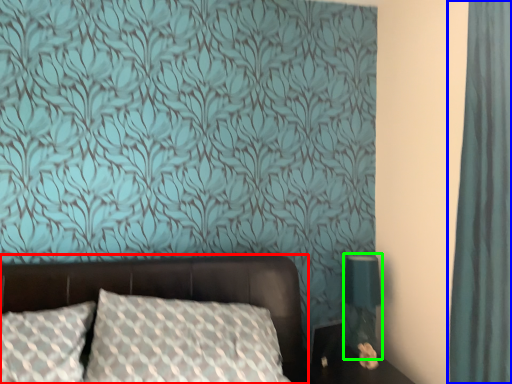
Question: Which object is positioned closest to bed (highlighted by a red box)? Select from curtain (highlighted by a blue box) and table lamp (highlighted by a green box).

Choices:
 (A) curtain
 (B) table lamp

Answer: (B)